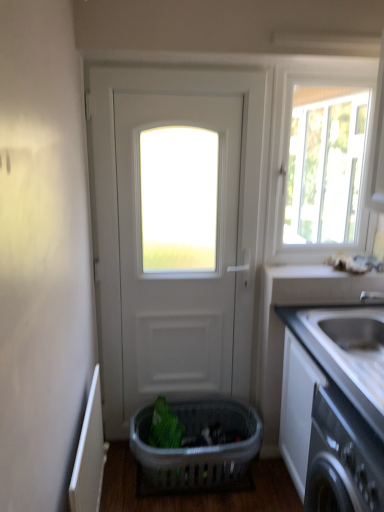
Question: Should I look upward or downward to see white glossy countertop at right?

Choices:
 (A) up
 (B) down

Answer: (B)

Question: Does plastic basket at center have a lesser width compared to white glossy countertop at right?

Choices:
 (A) no
 (B) yes

Answer: (B)

Question: Are plastic basket at center and white glossy countertop at right located far from each other?

Choices:
 (A) no
 (B) yes

Answer: (A)

Question: Is plastic basket at center wider than white glossy countertop at right?

Choices:
 (A) no
 (B) yes

Answer: (A)

Question: From the image's perspective, is plastic basket at center below white glossy countertop at right?

Choices:
 (A) no
 (B) yes

Answer: (B)

Question: From a real-world perspective, is plastic basket at center located higher than white glossy countertop at right?

Choices:
 (A) no
 (B) yes

Answer: (A)

Question: Is plastic basket at center smaller than white glossy countertop at right?

Choices:
 (A) yes
 (B) no

Answer: (A)

Question: From the image's perspective, is white matte door at center beneath white glossy window at upper right?

Choices:
 (A) yes
 (B) no

Answer: (A)

Question: From the image's perspective, does white matte door at center appear higher than white glossy window at upper right?

Choices:
 (A) yes
 (B) no

Answer: (B)

Question: Is white matte door at center shorter than white glossy window at upper right?

Choices:
 (A) no
 (B) yes

Answer: (A)

Question: Is white matte door at center aimed at white glossy window at upper right?

Choices:
 (A) yes
 (B) no

Answer: (B)

Question: Is white glossy window at upper right completely or partially inside white matte door at center?

Choices:
 (A) yes
 (B) no

Answer: (B)

Question: Considering the relative positions of white matte door at center and white glossy window at upper right in the image provided, is white matte door at center behind white glossy window at upper right?

Choices:
 (A) yes
 (B) no

Answer: (B)

Question: Does plastic basket at center have a larger size compared to white glossy window at upper right?

Choices:
 (A) no
 (B) yes

Answer: (B)